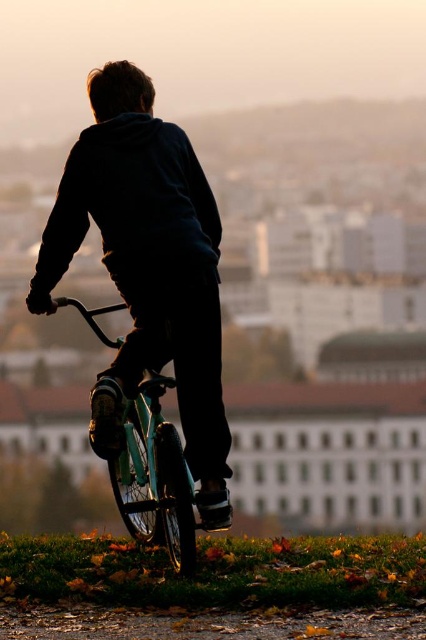
In the scene shown: Which is more to the right, dark blue hoodie at center or teal matte bicycle at center?

teal matte bicycle at center

Does dark blue hoodie at center appear on the right side of teal matte bicycle at center?

No, dark blue hoodie at center is not to the right of teal matte bicycle at center.

Find the location of a particular element. This screenshot has width=426, height=640. dark blue hoodie at center is located at coordinates (146, 268).

Find the location of a particular element. The image size is (426, 640). dark blue hoodie at center is located at coordinates (146, 268).